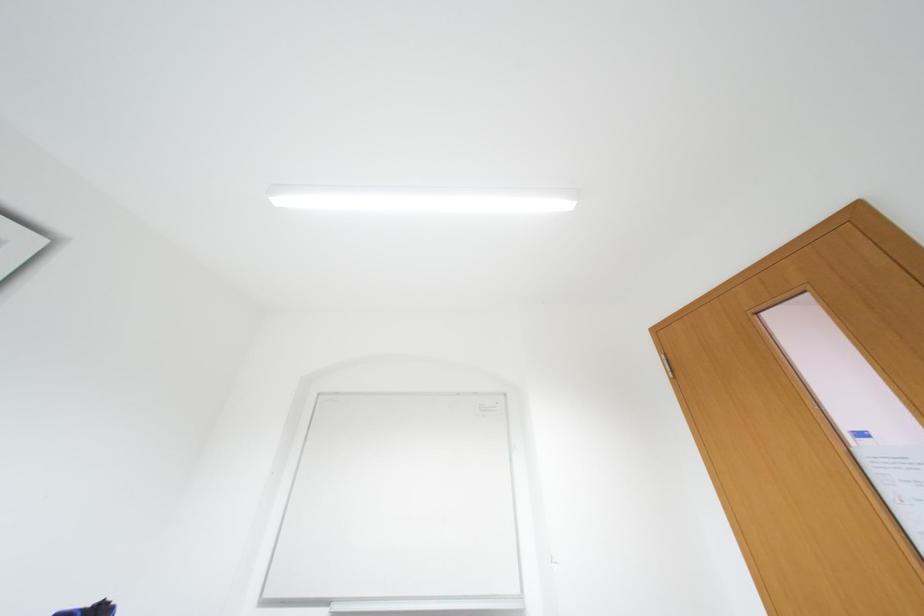
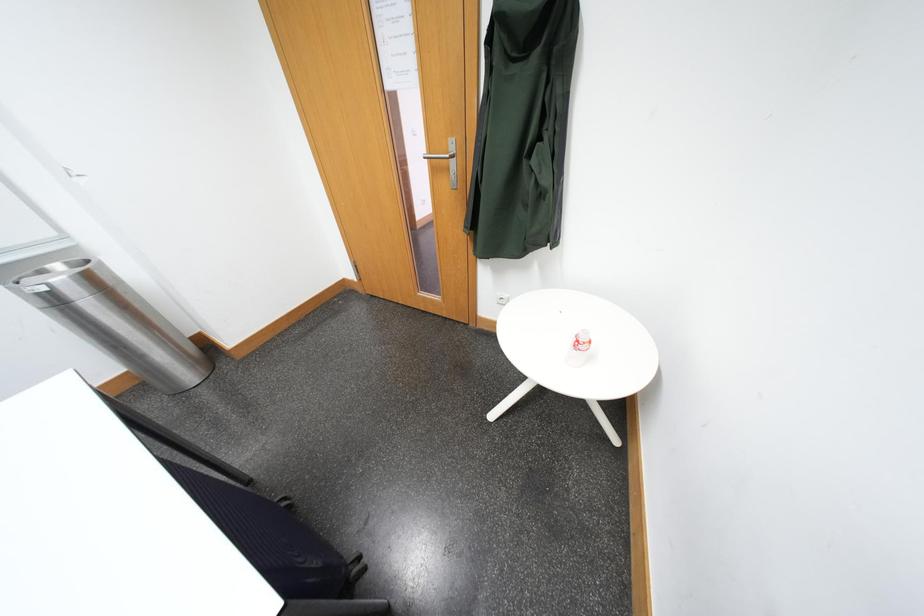
Based on the continuous images, in which direction is the camera rotating?

The rotation direction of the camera is right-down.